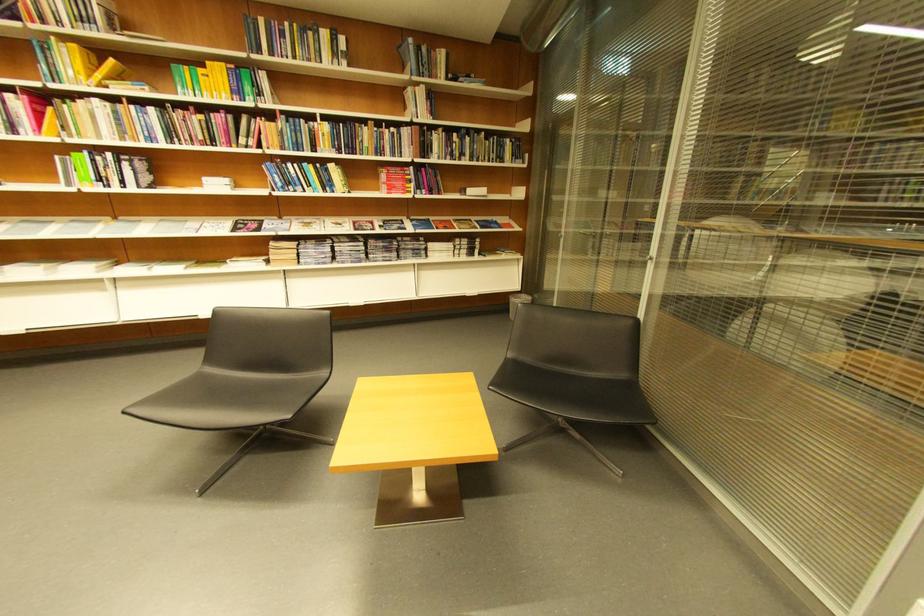
Find where to lift the small trash can. Please return your answer as a coordinate pair (x, y).

(517, 302)